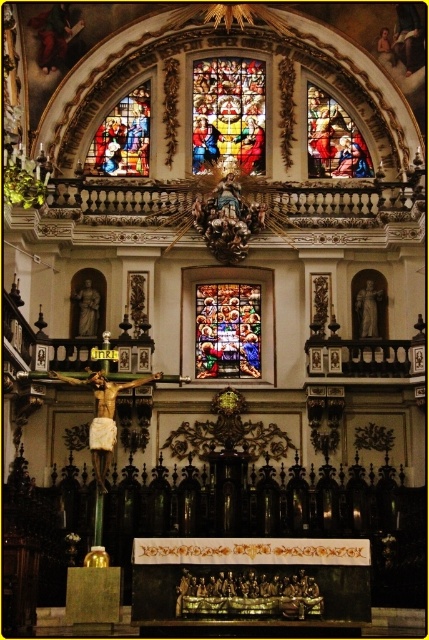
You are standing at the entrance of the church and want to locate two specific points in the altar area. The first point is labeled as point (214, 340) and the second is point (103, 150). Based on their positions, which point is closer to you?

Point (214, 340) is in front of point (103, 150), so it is closer to you.

You are a photographer standing at the entrance of the church. You want to take a photo of the stained glass window at upper center. Considering the distance, will you need to zoom in your camera lens to capture it clearly?

The stained glass window at upper center is 338.34 feet from camera, so you will need to zoom in your camera lens to capture it clearly.